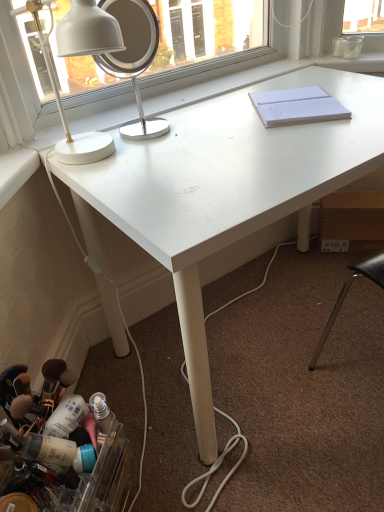
What is the approximate width of white metallic mirror at upper left?

5.63 inches.

This screenshot has width=384, height=512. Describe the element at coordinates (61, 447) in the screenshot. I see `translucent plastic container at lower left` at that location.

Identify the location of white glossy desk lamp at upper left. This screenshot has height=512, width=384. (88, 31).

Identify the location of white metallic mirror at upper left. (134, 59).

Based on their sizes in the image, would you say white paper notebook at upper right is bigger or smaller than white metallic mirror at upper left?

Clearly, white paper notebook at upper right is smaller in size than white metallic mirror at upper left.

Is point (280, 104) in front of point (138, 60)?

No, (280, 104) is further to viewer.

Based on the photo, from a real-world perspective, who is located lower, white paper notebook at upper right or white metallic mirror at upper left?

From a 3D spatial view, white paper notebook at upper right is below.

Is white paper notebook at upper right not inside white metallic mirror at upper left?

Absolutely, white paper notebook at upper right is external to white metallic mirror at upper left.

From a real-world perspective, is white paper notebook at upper right physically below white smooth window sill at upper right?

Actually, white paper notebook at upper right is physically above white smooth window sill at upper right in the real world.

This screenshot has width=384, height=512. I want to click on window sill behind the white paper notebook at upper right, so 353,63.

Which is more distant, [298,109] or [378,55]?

The point [378,55] is farther.

Consider the image. How different are the orientations of translucent plastic container at lower left and white metallic mirror at upper left in degrees?

The angle between the facing direction of translucent plastic container at lower left and the facing direction of white metallic mirror at upper left is 44.2 degrees.

Considering the relative positions of translucent plastic container at lower left and white metallic mirror at upper left in the image provided, is translucent plastic container at lower left to the right of white metallic mirror at upper left from the viewer's perspective?

Incorrect, translucent plastic container at lower left is not on the right side of white metallic mirror at upper left.

Can you confirm if translucent plastic container at lower left is taller than white metallic mirror at upper left?

Incorrect, the height of translucent plastic container at lower left is not larger of that of white metallic mirror at upper left.

Between translucent plastic container at lower left and white metallic mirror at upper left, which one has larger size?

translucent plastic container at lower left.

From a real-world perspective, between white paper notebook at upper right and translucent plastic container at lower left, who is vertically higher?

white paper notebook at upper right, from a real-world perspective.

Can you confirm if white paper notebook at upper right is smaller than translucent plastic container at lower left?

Yes, white paper notebook at upper right is smaller than translucent plastic container at lower left.

Is white paper notebook at upper right next to translucent plastic container at lower left?

They are not placed beside each other.

Which point is more forward, [292,93] or [65,35]?

The point [65,35] is in front.

Is white paper notebook at upper right inside or outside of white glossy desk lamp at upper left?

white paper notebook at upper right is not inside white glossy desk lamp at upper left, it's outside.

Does white paper notebook at upper right have a greater height compared to white glossy desk lamp at upper left?

Incorrect, the height of white paper notebook at upper right is not larger of that of white glossy desk lamp at upper left.

Is the depth of white matte desk at center greater than that of white paper notebook at upper right?

No, white matte desk at center is in front of white paper notebook at upper right.

Consider the image. Is white matte desk at center taller than white paper notebook at upper right?

Indeed, white matte desk at center has a greater height compared to white paper notebook at upper right.

From the picture: From a real-world perspective, between white matte desk at center and white paper notebook at upper right, who is vertically lower?

white matte desk at center.

From the image's perspective, between white smooth window sill at upper right and translucent plastic container at lower left, which one is located above?

white smooth window sill at upper right.

Who is smaller, white smooth window sill at upper right or translucent plastic container at lower left?

Smaller between the two is white smooth window sill at upper right.

Does point (345, 69) come behind point (90, 442)?

Yes.

Between white smooth window sill at upper right and translucent plastic container at lower left, which one appears on the right side from the viewer's perspective?

white smooth window sill at upper right is more to the right.

In the image, there is a white metallic mirror at upper left. Where is `notebook below it (from the image's perspective)`? Image resolution: width=384 pixels, height=512 pixels. notebook below it (from the image's perspective) is located at coordinates (297, 106).

The height and width of the screenshot is (512, 384). Find the location of `window sill above the white paper notebook at upper right (from the image's perspective)`. window sill above the white paper notebook at upper right (from the image's perspective) is located at coordinates (353, 63).

From the image, which object appears to be nearer to white matte desk at center, white paper notebook at upper right or white metallic mirror at upper left?

white paper notebook at upper right is closer to white matte desk at center.

When comparing their distances from translucent plastic container at lower left, does white smooth window sill at upper right or white glossy desk lamp at upper left seem closer?

Based on the image, white glossy desk lamp at upper left appears to be nearer to translucent plastic container at lower left.

Looking at the image, which one is located further to white smooth window sill at upper right, white paper notebook at upper right or white metallic mirror at upper left?

white metallic mirror at upper left lies further to white smooth window sill at upper right than the other object.

Based on their spatial positions, is white metallic mirror at upper left or white glossy desk lamp at upper left closer to white paper notebook at upper right?

The object closer to white paper notebook at upper right is white glossy desk lamp at upper left.

From the image, which object appears to be nearer to white paper notebook at upper right, white matte desk at center or white metallic mirror at upper left?

The object closer to white paper notebook at upper right is white matte desk at center.

When comparing their distances from white glossy desk lamp at upper left, does white metallic mirror at upper left or translucent plastic container at lower left seem further?

white metallic mirror at upper left is further to white glossy desk lamp at upper left.

Estimate the real-world distances between objects in this image. Which object is closer to white metallic mirror at upper left, translucent plastic container at lower left or white paper notebook at upper right?

Among the two, white paper notebook at upper right is located nearer to white metallic mirror at upper left.

Based on their spatial positions, is white matte desk at center or white metallic mirror at upper left closer to translucent plastic container at lower left?

white matte desk at center.

Where is `notebook that lies between white smooth window sill at upper right and translucent plastic container at lower left from top to bottom`? notebook that lies between white smooth window sill at upper right and translucent plastic container at lower left from top to bottom is located at coordinates (297, 106).

Locate an element on the screen. desk between white glossy desk lamp at upper left and white paper notebook at upper right is located at coordinates (228, 190).

This screenshot has width=384, height=512. I want to click on mirror that lies between white smooth window sill at upper right and translucent plastic container at lower left from top to bottom, so click(x=134, y=59).

At what (x,y) coordinates should I click in order to perform the action: click on lamp between white metallic mirror at upper left and translucent plastic container at lower left in the vertical direction. Please return your answer as a coordinate pair (x, y). The image size is (384, 512). Looking at the image, I should click on [88, 31].